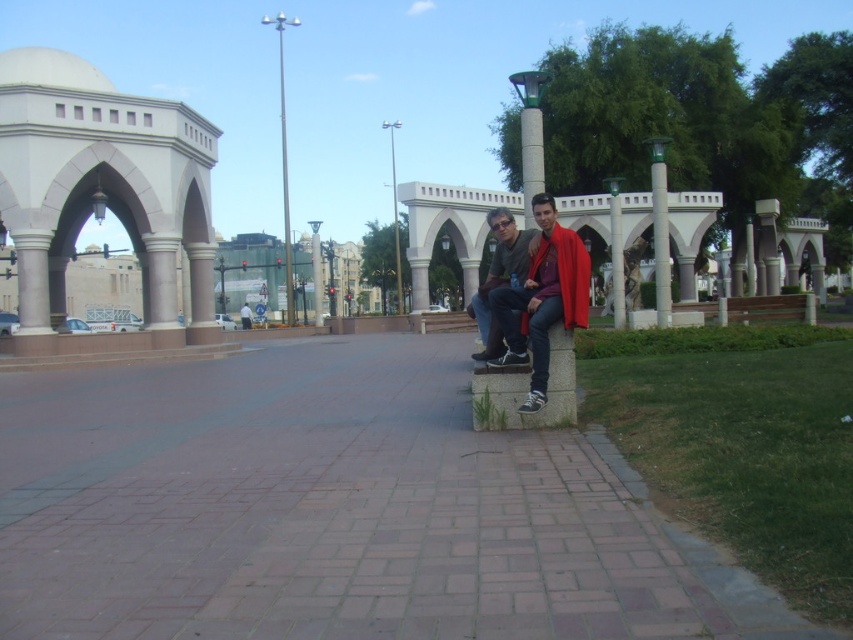
You are a photographer trying to capture both the red fabric cape at center and the matte black jacket at center in a single frame. Given their sizes, which object should you focus on to ensure both are visible without zooming in too much?

Since the red fabric cape at center occupies less space than the matte black jacket at center, you should focus on the matte black jacket at center as it is larger and will be easier to frame while keeping the smaller red fabric cape at center in view.

You are a delivery person with a cart that is 3 meters wide. You need to move from the brick pavement at center to the red fabric cape at center. Is there enough space for your cart to pass between them?

The distance between the brick pavement at center and the red fabric cape at center is 2.92 meters. Since the cart is 3 meters wide, it is slightly too wide to pass through the space between them. You may need to find an alternative route or adjust your cart to fit within the available space.